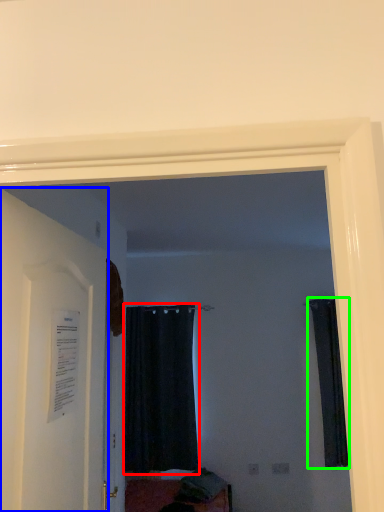
Question: Estimate the real-world distances between objects in this image. Which object is farther from curtain (highlighted by a red box), door (highlighted by a blue box) or curtain (highlighted by a green box)?

Choices:
 (A) door
 (B) curtain

Answer: (A)